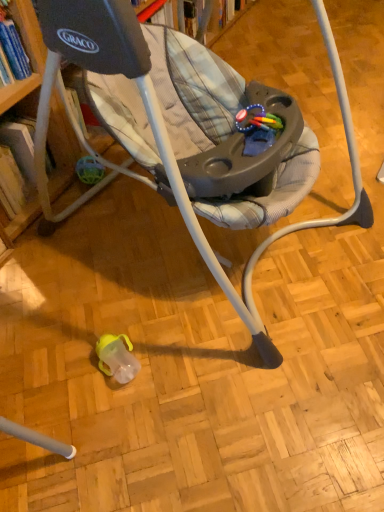
Question: Is there a large distance between matte gray baby swing at center and hardcover book at left?

Choices:
 (A) no
 (B) yes

Answer: (A)

Question: Is hardcover book at left surrounded by matte gray baby swing at center?

Choices:
 (A) no
 (B) yes

Answer: (A)

Question: Would you say matte gray baby swing at center is outside hardcover book at left?

Choices:
 (A) no
 (B) yes

Answer: (B)

Question: Is matte gray baby swing at center in front of hardcover book at left?

Choices:
 (A) yes
 (B) no

Answer: (A)

Question: Is matte gray baby swing at center oriented towards hardcover book at left?

Choices:
 (A) yes
 (B) no

Answer: (B)

Question: Considering the positions of matte gray baby swing at center and hardcover book at left in the image, is matte gray baby swing at center wider or thinner than hardcover book at left?

Choices:
 (A) wide
 (B) thin

Answer: (A)

Question: From a real-world perspective, relative to hardcover book at left, is matte gray baby swing at center vertically above or below?

Choices:
 (A) below
 (B) above

Answer: (B)

Question: From the image's perspective, is matte gray baby swing at center located above or below hardcover book at left?

Choices:
 (A) above
 (B) below

Answer: (A)

Question: In the image, is matte gray baby swing at center positioned in front of or behind hardcover book at left?

Choices:
 (A) front
 (B) behind

Answer: (A)

Question: Does point (254, 137) appear closer or farther from the camera than point (59, 80)?

Choices:
 (A) closer
 (B) farther

Answer: (B)

Question: Is rubberized plastic teething ring at center to the left or to the right of matte gray baby swing at center in the image?

Choices:
 (A) right
 (B) left

Answer: (A)

Question: From a real-world perspective, is rubberized plastic teething ring at center positioned above or below matte gray baby swing at center?

Choices:
 (A) below
 (B) above

Answer: (A)

Question: From the image's perspective, relative to matte gray baby swing at center, is rubberized plastic teething ring at center above or below?

Choices:
 (A) below
 (B) above

Answer: (A)

Question: Considering their positions, is hardcover book at left located in front of or behind rubberized plastic teething ring at center?

Choices:
 (A) behind
 (B) front

Answer: (A)

Question: Visually, is hardcover book at left positioned to the left or to the right of rubberized plastic teething ring at center?

Choices:
 (A) right
 (B) left

Answer: (B)